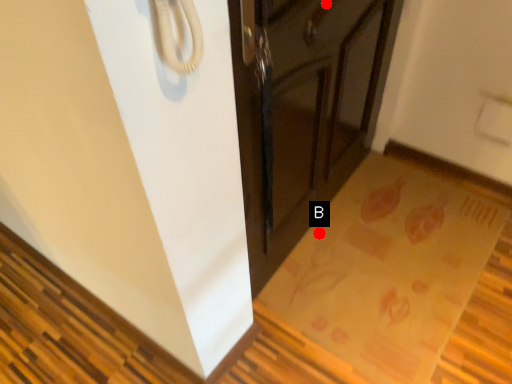
Question: Two points are circled on the image, labeled by A and B beside each circle. Among these points, which one is nearest to the camera?

Choices:
 (A) A is closer
 (B) B is closer

Answer: (A)